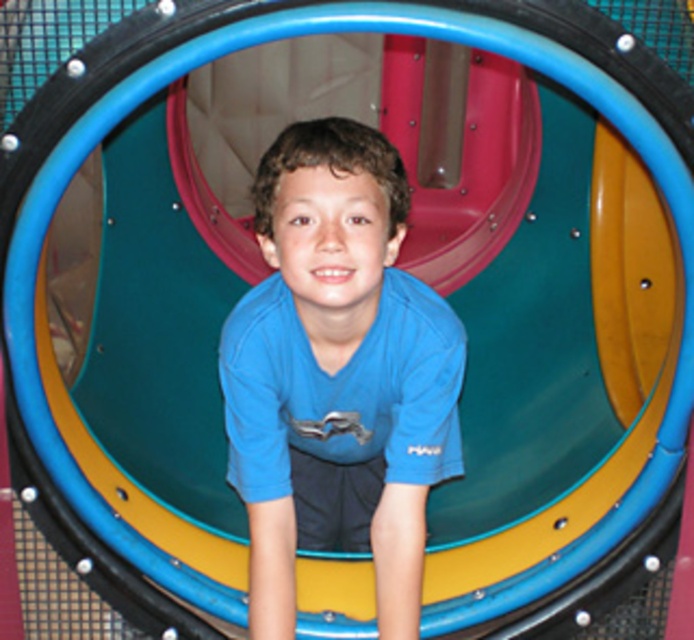
You are a photographer trying to capture the boy in the playground tunnel. You notice the blue matte shirt at center and the matte blue shirt at center. Which one is taller?

The blue matte shirt at center is much taller than the matte blue shirt at center according to the description.

You are a photographer standing at the entrance of the playground tunnel. You have a camera with a 3.5 inch wide lens. You want to take a photo of both the blue matte shirt at center and the matte blue shirt at center. Can the lens capture both subjects in the same frame?

The distance between the blue matte shirt at center and the matte blue shirt at center is 4.27 inches. Since the lens is only 3.5 inches wide, it cannot capture both subjects in the same frame as the distance between them exceeds the lens width.